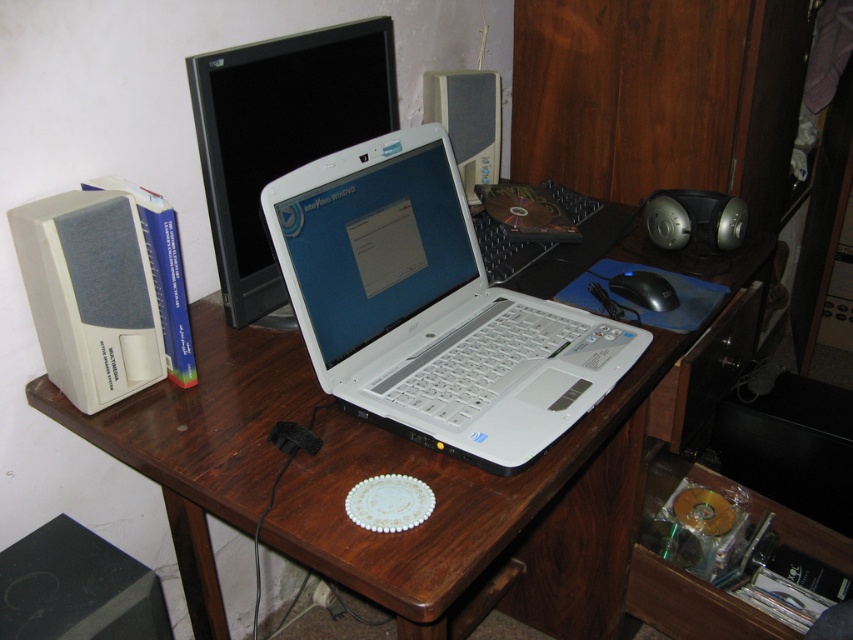
Is wooden desk at center further to the viewer compared to white plastic laptop at center?

No, it is not.

What do you see at coordinates (485, 515) in the screenshot? The image size is (853, 640). I see `wooden desk at center` at bounding box center [485, 515].

Identify the location of wooden desk at center. The height and width of the screenshot is (640, 853). (485, 515).

Who is shorter, white matte speaker at left or matte gray speaker at center?

white matte speaker at left

Consider the image. Is white matte speaker at left thinner than matte gray speaker at center?

Indeed, white matte speaker at left has a lesser width compared to matte gray speaker at center.

Is point (51, 282) less distant than point (456, 100)?

That is True.

The height and width of the screenshot is (640, 853). What are the coordinates of `white matte speaker at left` in the screenshot? It's located at (90, 294).

Who is positioned more to the left, black glossy monitor at upper center or black plastic mouse at lower right?

black glossy monitor at upper center

Is black glossy monitor at upper center shorter than black plastic mouse at lower right?

No, black glossy monitor at upper center is not shorter than black plastic mouse at lower right.

This screenshot has height=640, width=853. Identify the location of black glossy monitor at upper center. (280, 134).

Locate an element on the screen. This screenshot has height=640, width=853. black glossy monitor at upper center is located at coordinates (280, 134).